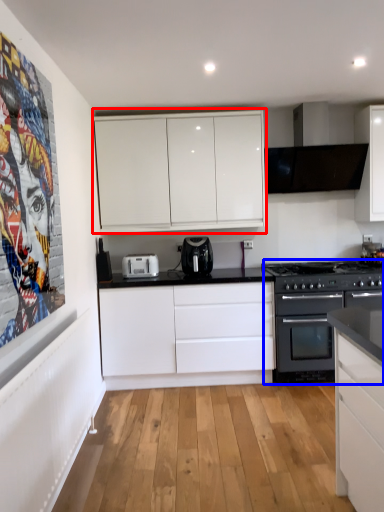
Question: Which object is closer to the camera taking this photo, cabinetry (highlighted by a red box) or appliance (highlighted by a blue box)?

Choices:
 (A) cabinetry
 (B) appliance

Answer: (B)